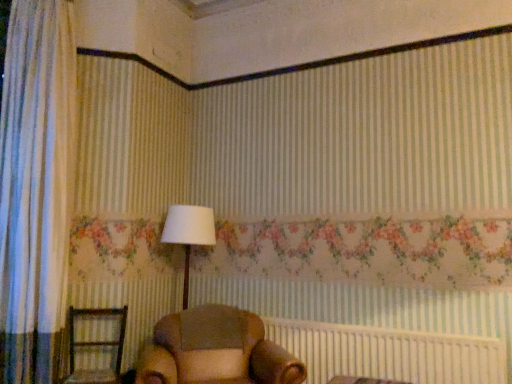
Question: Does brown leather armchair at center, which is counted as the 1th furniture, starting from the right, appear on the right side of white fabric lampshade at center?

Choices:
 (A) no
 (B) yes

Answer: (B)

Question: From the image's perspective, would you say brown leather armchair at center, which is counted as the 1th furniture, starting from the right, is shown under white fabric lampshade at center?

Choices:
 (A) no
 (B) yes

Answer: (B)

Question: Is brown leather armchair at center, which is counted as the 1th furniture, starting from the right, taller than white fabric lampshade at center?

Choices:
 (A) yes
 (B) no

Answer: (B)

Question: Does brown leather armchair at center, which is counted as the 1th furniture, starting from the right, have a larger size compared to white fabric lampshade at center?

Choices:
 (A) yes
 (B) no

Answer: (A)

Question: Would you say brown leather armchair at center, which is counted as the 1th furniture, starting from the right, is outside white fabric lampshade at center?

Choices:
 (A) yes
 (B) no

Answer: (A)

Question: Considering the relative positions of brown leather armchair at center, which is counted as the 1th furniture, starting from the right, and white fabric lampshade at center in the image provided, is brown leather armchair at center, which is counted as the 1th furniture, starting from the right, behind white fabric lampshade at center?

Choices:
 (A) no
 (B) yes

Answer: (A)

Question: Does brown fabric bed frame at lower center have a greater height compared to white fabric lampshade at center?

Choices:
 (A) yes
 (B) no

Answer: (B)

Question: Is brown fabric bed frame at lower center wider than white fabric lampshade at center?

Choices:
 (A) yes
 (B) no

Answer: (B)

Question: Could you tell me if brown fabric bed frame at lower center is turned towards white fabric lampshade at center?

Choices:
 (A) yes
 (B) no

Answer: (B)

Question: Considering the relative sizes of brown fabric bed frame at lower center and white fabric lampshade at center in the image provided, is brown fabric bed frame at lower center thinner than white fabric lampshade at center?

Choices:
 (A) no
 (B) yes

Answer: (B)

Question: Does brown fabric bed frame at lower center contain white fabric lampshade at center?

Choices:
 (A) no
 (B) yes

Answer: (A)

Question: Is brown fabric bed frame at lower center in contact with white fabric lampshade at center?

Choices:
 (A) no
 (B) yes

Answer: (A)

Question: Is white fabric lampshade at center turned away from brown leather armchair at center, which ranks as the second furniture in left-to-right order?

Choices:
 (A) no
 (B) yes

Answer: (A)